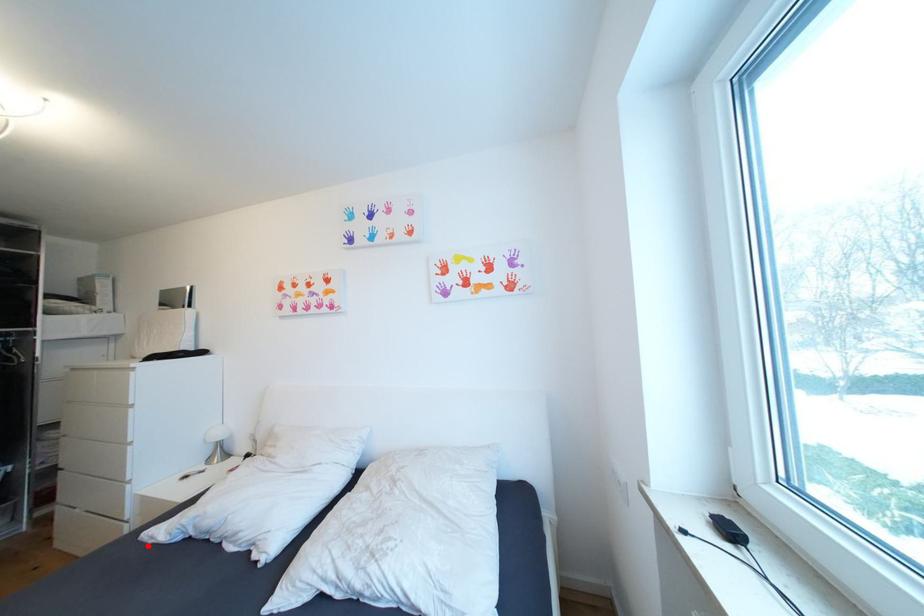
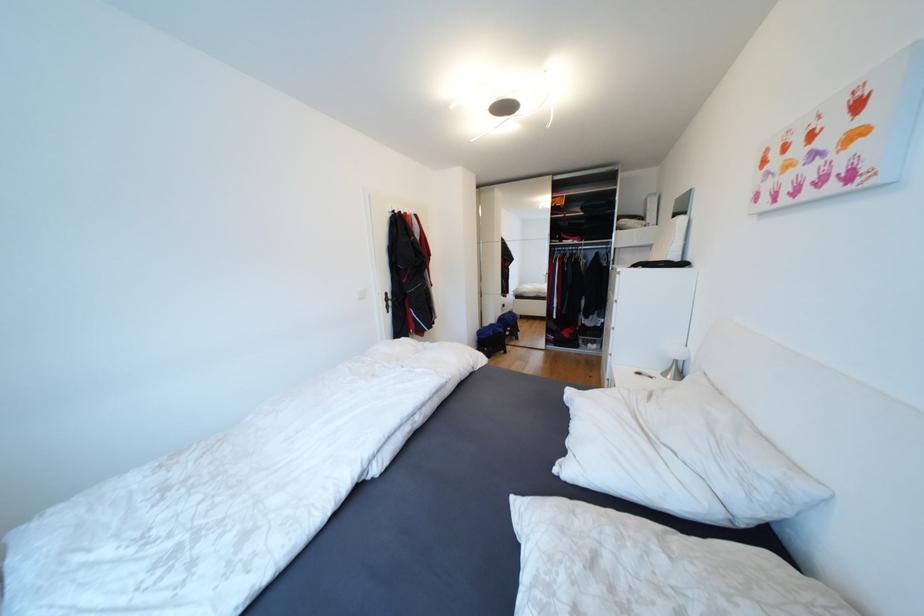
Question: I am providing you with two images of the same scene from different viewpoints. Image1 has a red point marked. In image2, the corresponding 3D location appears at what relative position? Reply with the corresponding letter.

Choices:
 (A) Closer
 (B) Farther

Answer: (B)